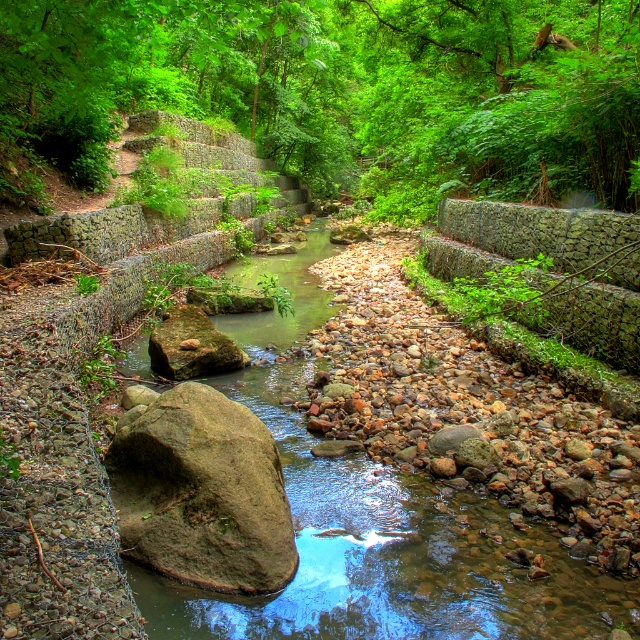
You are standing at the point with coordinates (376,515) in the image. What is located exactly at that point?

The point at coordinates (376,515) is occupied by the smooth stone stream at center.

You are a hiker navigating the forest path near the stream. You spot two points marked on the map at coordinates point [365,579] and point [189,573]. If you are facing the stream, which point is closer to your back?

Point [365,579] is behind point [189,573], so if you are facing the stream, point [365,579] would be closer to your back.

In the scene shown: You are a hiker who wants to cross the smooth stone stream at center. There is a fallen log on the right side of the green leafy forest at center. Which direction should you go to reach the log?

The green leafy forest at center is to the left of the smooth stone stream at center, so the log is on the right side of the forest. To reach the log, you should go to the right side of the green leafy forest at center.